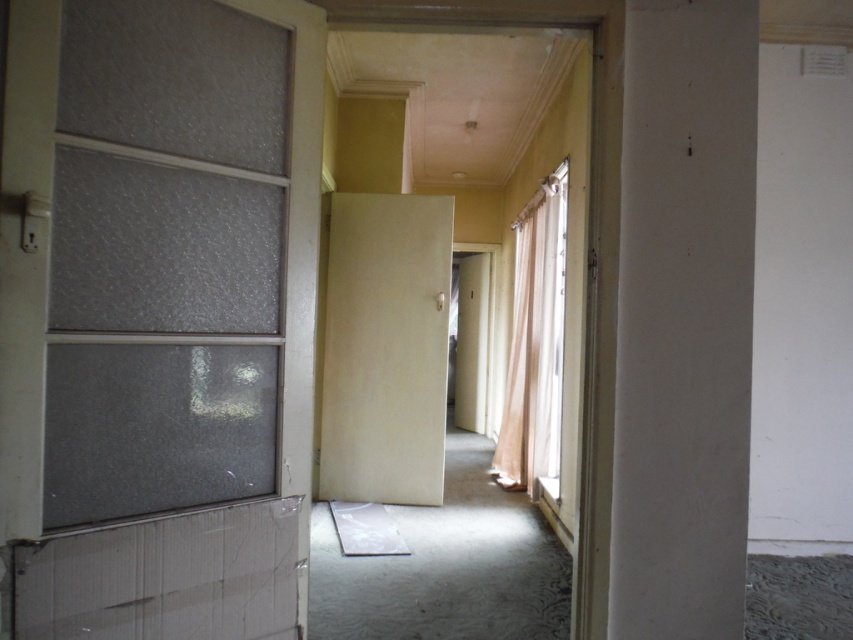
Who is positioned more to the right, matte beige door at center or transparent plastic screen door at center?

transparent plastic screen door at center

Consider the image. Can you confirm if matte beige door at center is positioned to the right of transparent plastic screen door at center?

No, matte beige door at center is not to the right of transparent plastic screen door at center.

Find the location of a particular element. matte beige door at center is located at coordinates (386, 348).

This screenshot has height=640, width=853. Identify the location of matte beige door at center. (386, 348).

Which of these two, sheer beige curtain at right or transparent plastic screen door at center, stands shorter?

transparent plastic screen door at center is shorter.

Does sheer beige curtain at right have a lesser height compared to transparent plastic screen door at center?

In fact, sheer beige curtain at right may be taller than transparent plastic screen door at center.

Identify the location of sheer beige curtain at right. (534, 340).

Is matte beige door at center taller than sheer beige curtain at right?

Incorrect, matte beige door at center's height is not larger of sheer beige curtain at right's.

Who is shorter, matte beige door at center or sheer beige curtain at right?

Standing shorter between the two is matte beige door at center.

Measure the distance between point (376, 429) and camera.

4.88 meters

Find the location of a particular element. This screenshot has width=853, height=640. matte beige door at center is located at coordinates (386, 348).